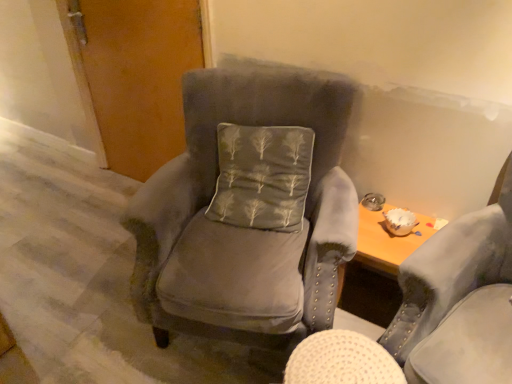
Question: From the image's perspective, would you say velvet gray chair at center, the 2th chair from the right, is positioned over matte wood door at upper left?

Choices:
 (A) yes
 (B) no

Answer: (B)

Question: Can you confirm if velvet gray chair at center, which appears as the 1th chair when viewed from the left, is thinner than matte wood door at upper left?

Choices:
 (A) no
 (B) yes

Answer: (A)

Question: Is velvet gray chair at center, which appears as the 1th chair when viewed from the left, to the left of matte wood door at upper left from the viewer's perspective?

Choices:
 (A) no
 (B) yes

Answer: (A)

Question: From the image's perspective, is velvet gray chair at center, the 2th chair from the right, below matte wood door at upper left?

Choices:
 (A) yes
 (B) no

Answer: (A)

Question: Is the depth of velvet gray chair at center, which appears as the 1th chair when viewed from the left, greater than that of matte wood door at upper left?

Choices:
 (A) no
 (B) yes

Answer: (A)

Question: Is velvet gray chair at center, which appears as the 1th chair when viewed from the left, facing away from matte wood door at upper left?

Choices:
 (A) no
 (B) yes

Answer: (A)

Question: Can you confirm if velvet gray chair at center, the 2th chair from the right, is bigger than velvet gray armchair at center, which ranks as the 1th chair in right-to-left order?

Choices:
 (A) yes
 (B) no

Answer: (A)

Question: From the image's perspective, is velvet gray chair at center, which appears as the 1th chair when viewed from the left, below velvet gray armchair at center, the 2th chair positioned from the left?

Choices:
 (A) yes
 (B) no

Answer: (B)

Question: Can you confirm if velvet gray chair at center, which appears as the 1th chair when viewed from the left, is thinner than velvet gray armchair at center, which ranks as the 1th chair in right-to-left order?

Choices:
 (A) no
 (B) yes

Answer: (A)

Question: Is velvet gray chair at center, the 2th chair from the right, in front of velvet gray armchair at center, which ranks as the 1th chair in right-to-left order?

Choices:
 (A) yes
 (B) no

Answer: (B)

Question: Is velvet gray chair at center, which appears as the 1th chair when viewed from the left, to the left of velvet gray armchair at center, the 2th chair positioned from the left, from the viewer's perspective?

Choices:
 (A) yes
 (B) no

Answer: (A)

Question: Is velvet gray chair at center, which appears as the 1th chair when viewed from the left, oriented towards velvet gray armchair at center, which ranks as the 1th chair in right-to-left order?

Choices:
 (A) no
 (B) yes

Answer: (A)

Question: Considering the relative sizes of matte wood door at upper left and satin gray pillow at center in the image provided, is matte wood door at upper left shorter than satin gray pillow at center?

Choices:
 (A) no
 (B) yes

Answer: (A)